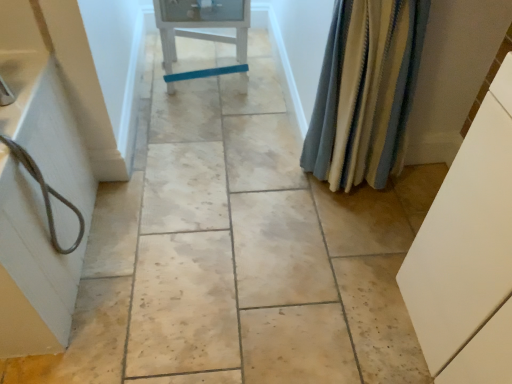
Identify the location of free region under white painted wood chair at center (from a real-world perspective). (215, 87).